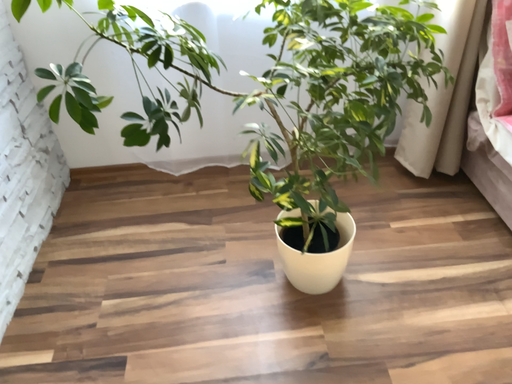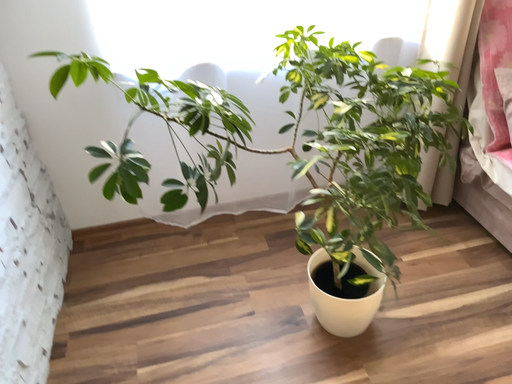
Question: How did the camera likely rotate when shooting the video?

Choices:
 (A) rotated left
 (B) rotated right

Answer: (B)